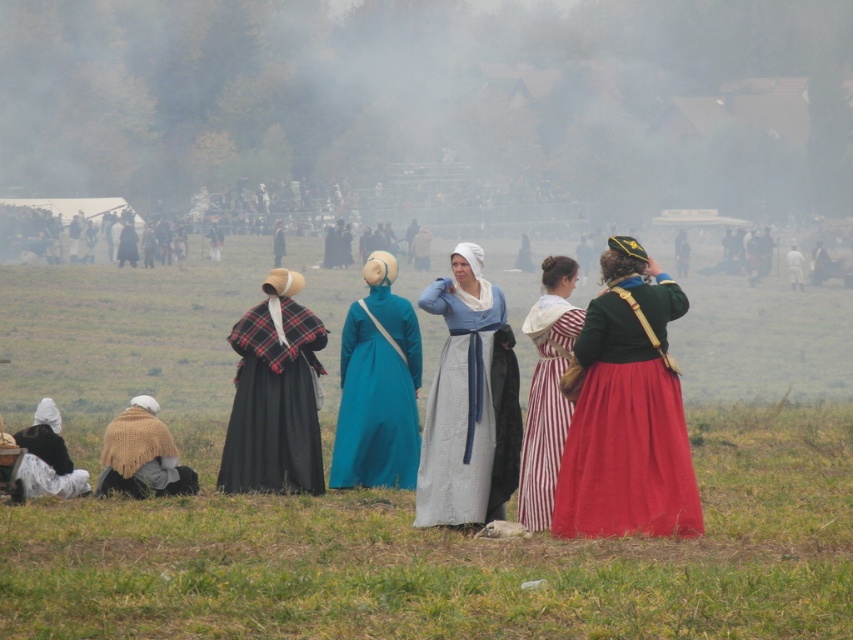
Is black woolen scarf at lower left bigger than blue cotton dress at center?

Actually, black woolen scarf at lower left might be smaller than blue cotton dress at center.

Can you confirm if black woolen scarf at lower left is smaller than blue cotton dress at center?

Indeed, black woolen scarf at lower left has a smaller size compared to blue cotton dress at center.

Between point (24, 477) and point (281, 250), which one is positioned behind?

Point (281, 250)

This screenshot has width=853, height=640. Identify the location of black woolen scarf at lower left. (48, 464).

Does matte blue fabric dress at center lie behind black woolen scarf at lower left?

No.

Looking at this image, is matte blue fabric dress at center above black woolen scarf at lower left?

Yes, matte blue fabric dress at center is above black woolen scarf at lower left.

Does point (466, 340) lie behind point (68, 461)?

No, (466, 340) is closer to viewer.

Locate an element on the screen. Image resolution: width=853 pixels, height=640 pixels. matte blue fabric dress at center is located at coordinates (463, 401).

Does striped cotton dress at center have a smaller size compared to black woolen scarf at lower left?

Correct, striped cotton dress at center occupies less space than black woolen scarf at lower left.

Describe the element at coordinates (547, 390) in the screenshot. I see `striped cotton dress at center` at that location.

Between point (550, 465) and point (50, 449), which one is positioned behind?

Positioned behind is point (50, 449).

Identify the location of striped cotton dress at center. (547, 390).